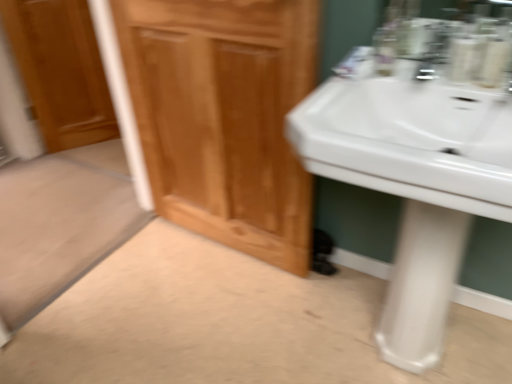
Image resolution: width=512 pixels, height=384 pixels. Identify the location of empty space that is to the right of white glossy pedestal at lower right. (476, 343).